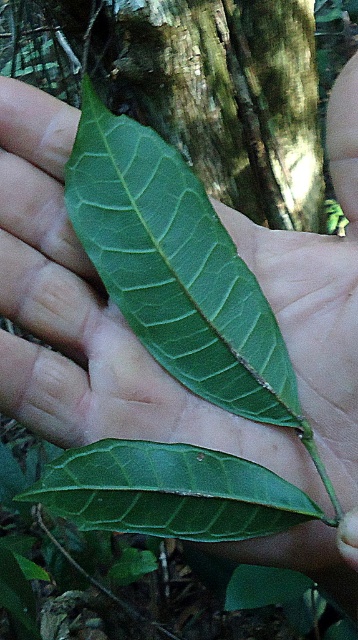
Question: Among these points, which one is nearest to the camera?

Choices:
 (A) (264, 477)
 (B) (279, 339)

Answer: (A)

Question: Does green matte leaf at center appear on the right side of green glossy leaf at center?

Choices:
 (A) no
 (B) yes

Answer: (A)

Question: Can you confirm if green matte leaf at center is positioned above green glossy leaf at center?

Choices:
 (A) no
 (B) yes

Answer: (B)

Question: Which of the following is the closest to the observer?

Choices:
 (A) (268, 532)
 (B) (234, 356)

Answer: (A)

Question: Which of the following is the closest to the observer?

Choices:
 (A) green glossy leaf at center
 (B) green matte leaf at center

Answer: (B)

Question: Is green matte leaf at center bigger than green glossy leaf at center?

Choices:
 (A) no
 (B) yes

Answer: (B)